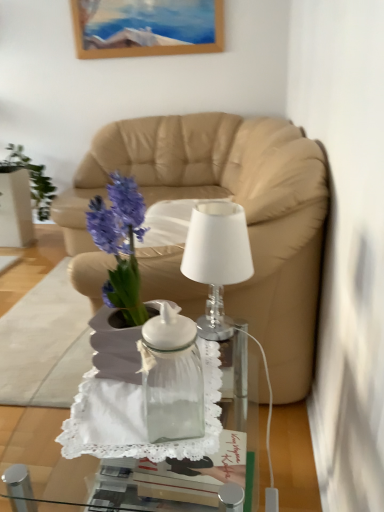
Question: Are transparent glass vase at center and beige leather couch at center far apart?

Choices:
 (A) no
 (B) yes

Answer: (B)

Question: Is transparent glass vase at center closer to the viewer compared to beige leather couch at center?

Choices:
 (A) no
 (B) yes

Answer: (B)

Question: Is transparent glass vase at center facing towards beige leather couch at center?

Choices:
 (A) no
 (B) yes

Answer: (A)

Question: Can you confirm if transparent glass vase at center is positioned to the right of beige leather couch at center?

Choices:
 (A) no
 (B) yes

Answer: (B)

Question: Can we say transparent glass vase at center lies outside beige leather couch at center?

Choices:
 (A) no
 (B) yes

Answer: (B)

Question: In the image, is transparent glass vase at center on the left side or the right side of white glass lamp at center?

Choices:
 (A) right
 (B) left

Answer: (B)

Question: From a real-world perspective, relative to white glass lamp at center, is transparent glass vase at center vertically above or below?

Choices:
 (A) above
 (B) below

Answer: (B)

Question: From the image's perspective, is transparent glass vase at center positioned above or below white glass lamp at center?

Choices:
 (A) below
 (B) above

Answer: (A)

Question: Looking at their shapes, would you say transparent glass vase at center is wider or thinner than white glass lamp at center?

Choices:
 (A) thin
 (B) wide

Answer: (A)

Question: Considering the positions of white glass lamp at center and transparent glass jar at center in the image, is white glass lamp at center wider or thinner than transparent glass jar at center?

Choices:
 (A) wide
 (B) thin

Answer: (B)

Question: Is point (215, 206) positioned closer to the camera than point (213, 451)?

Choices:
 (A) closer
 (B) farther

Answer: (B)

Question: Visually, is white glass lamp at center positioned to the left or to the right of transparent glass jar at center?

Choices:
 (A) left
 (B) right

Answer: (B)

Question: From the image's perspective, is white glass lamp at center above or below transparent glass jar at center?

Choices:
 (A) below
 (B) above

Answer: (B)

Question: From their relative heights in the image, would you say transparent glass jar at center is taller or shorter than beige leather couch at center?

Choices:
 (A) tall
 (B) short

Answer: (B)

Question: In terms of size, does transparent glass jar at center appear bigger or smaller than beige leather couch at center?

Choices:
 (A) small
 (B) big

Answer: (A)